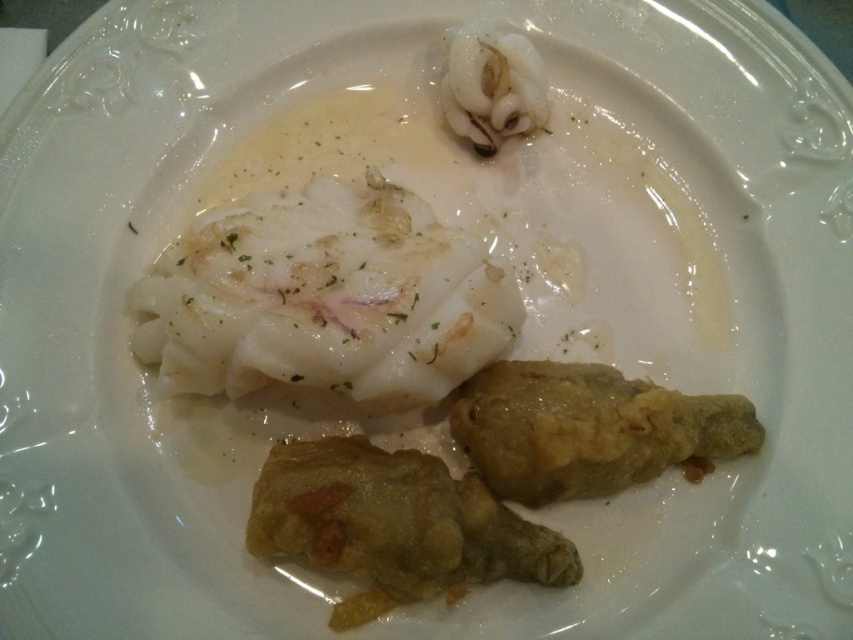
Question: Does golden crispy chicken leg at center appear on the left side of white glossy squid at upper center?

Choices:
 (A) no
 (B) yes

Answer: (B)

Question: Which of the following is the closest to the observer?

Choices:
 (A) white glossy squid at upper center
 (B) white creamy fish at center

Answer: (B)

Question: Which point is farther to the camera?

Choices:
 (A) white creamy fish at center
 (B) golden crispy chicken leg at center
 (C) golden crispy fried chicken leg at lower right
 (D) white glossy squid at upper center

Answer: (D)

Question: Can you confirm if golden crispy chicken leg at center is positioned below golden crispy fried chicken leg at lower right?

Choices:
 (A) no
 (B) yes

Answer: (B)

Question: Which object is farther from the camera taking this photo?

Choices:
 (A) golden crispy chicken leg at center
 (B) white creamy fish at center
 (C) white glossy squid at upper center
 (D) golden crispy fried chicken leg at lower right

Answer: (C)

Question: Can you confirm if golden crispy chicken leg at center is positioned to the right of white glossy squid at upper center?

Choices:
 (A) no
 (B) yes

Answer: (A)